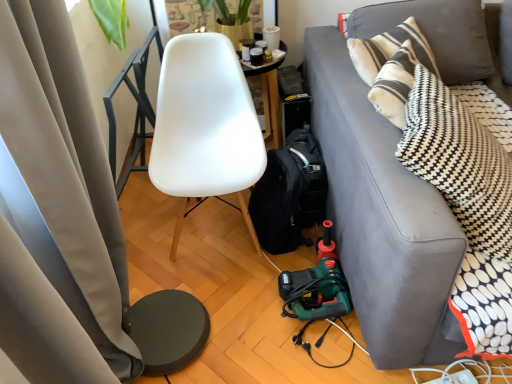
At what (x,y) coordinates should I click in order to perform the action: click on black fabric backpack at lower center. Please return your answer as a coordinate pair (x, y). Image resolution: width=512 pixels, height=384 pixels. Looking at the image, I should click on (289, 194).

The height and width of the screenshot is (384, 512). Describe the element at coordinates (205, 126) in the screenshot. I see `white matte chair at center` at that location.

This screenshot has width=512, height=384. I want to click on black fabric backpack at lower center, so click(x=289, y=194).

How different are the orientations of gray fabric couch at right and black fabric backpack at lower center in degrees?

1.77 degrees separate the facing orientations of gray fabric couch at right and black fabric backpack at lower center.

From a real-world perspective, is gray fabric couch at right above or below black fabric backpack at lower center?

Clearly, from a real-world perspective, gray fabric couch at right is above black fabric backpack at lower center.

Identify the location of backpack on the left of gray fabric couch at right. The width and height of the screenshot is (512, 384). (289, 194).

Based on the photo, between gray fabric couch at right and black fabric backpack at lower center, which one has smaller width?

Thinner between the two is black fabric backpack at lower center.

I want to click on studio couch that appears above the white plastic power outlet at lower right (from the image's perspective), so click(382, 218).

Considering the sizes of objects gray fabric couch at right and white plastic power outlet at lower right in the image provided, who is thinner, gray fabric couch at right or white plastic power outlet at lower right?

white plastic power outlet at lower right.

Is gray fabric couch at right turned away from white plastic power outlet at lower right?

gray fabric couch at right is not turned away from white plastic power outlet at lower right.

Is there a large distance between matte gray curtain at left and white matte chair at center?

They are positioned close to each other.

Is matte gray curtain at left bigger or smaller than white matte chair at center?

In the image, matte gray curtain at left appears to be larger than white matte chair at center.

Is matte gray curtain at left facing away from white matte chair at center?

matte gray curtain at left does not have its back to white matte chair at center.

Is gray fabric couch at right closer to the viewer compared to white matte chair at center?

That is True.

From the image's perspective, is gray fabric couch at right beneath white matte chair at center?

No.

Is gray fabric couch at right positioned with its back to white matte chair at center?

No.

Who is taller, gray fabric couch at right or white matte chair at center?

Standing taller between the two is white matte chair at center.

Does matte gray curtain at left appear on the left side of white plastic power outlet at lower right?

Yes, matte gray curtain at left is to the left of white plastic power outlet at lower right.

Which of these two, matte gray curtain at left or white plastic power outlet at lower right, is bigger?

Bigger between the two is matte gray curtain at left.

Are matte gray curtain at left and white plastic power outlet at lower right located far from each other?

Yes, matte gray curtain at left and white plastic power outlet at lower right are quite far apart.

Considering the relative sizes of black fabric backpack at lower center and white matte chair at center in the image provided, is black fabric backpack at lower center bigger than white matte chair at center?

Incorrect, black fabric backpack at lower center is not larger than white matte chair at center.

Consider the image. From their relative heights in the image, would you say black fabric backpack at lower center is taller or shorter than white matte chair at center?

black fabric backpack at lower center is shorter than white matte chair at center.

Considering the sizes of black fabric backpack at lower center and white matte chair at center in the image, is black fabric backpack at lower center wider or thinner than white matte chair at center?

In the image, black fabric backpack at lower center appears to be wider than white matte chair at center.

From the image's perspective, between white plastic power outlet at lower right and black fabric backpack at lower center, who is located below?

white plastic power outlet at lower right, from the image's perspective.

Does white plastic power outlet at lower right come in front of black fabric backpack at lower center?

Yes.

Would you say white plastic power outlet at lower right is a long distance from black fabric backpack at lower center?

They are positioned close to each other.

Considering the sizes of objects white plastic power outlet at lower right and black fabric backpack at lower center in the image provided, who is taller, white plastic power outlet at lower right or black fabric backpack at lower center?

With more height is black fabric backpack at lower center.

Identify the location of backpack behind the gray fabric couch at right. The width and height of the screenshot is (512, 384). (289, 194).

In order to click on power outlet on the left of gray fabric couch at right in this screenshot , I will do `click(455, 378)`.

Which object lies further to the anchor point black fabric backpack at lower center, matte gray curtain at left or white plastic power outlet at lower right?

white plastic power outlet at lower right is positioned further to the anchor black fabric backpack at lower center.

Which object lies further to the anchor point matte gray curtain at left, white matte chair at center or white plastic power outlet at lower right?

Based on the image, white plastic power outlet at lower right appears to be further to matte gray curtain at left.

Looking at the image, which one is located further to black fabric backpack at lower center, matte gray curtain at left or white matte chair at center?

The object further to black fabric backpack at lower center is matte gray curtain at left.

Considering their positions, is white plastic power outlet at lower right positioned closer to gray fabric couch at right than black fabric backpack at lower center?

The object closer to gray fabric couch at right is black fabric backpack at lower center.

From the picture: Which object lies further to the anchor point white matte chair at center, matte gray curtain at left or white plastic power outlet at lower right?

white plastic power outlet at lower right.

Based on their spatial positions, is gray fabric couch at right or black fabric backpack at lower center closer to matte gray curtain at left?

black fabric backpack at lower center lies closer to matte gray curtain at left than the other object.

Considering their positions, is white plastic power outlet at lower right positioned further to black fabric backpack at lower center than matte gray curtain at left?

Based on the image, white plastic power outlet at lower right appears to be further to black fabric backpack at lower center.

From the image, which object appears to be farther from white matte chair at center, white plastic power outlet at lower right or matte gray curtain at left?

white plastic power outlet at lower right.

At what (x,y) coordinates should I click in order to perform the action: click on chair between matte gray curtain at left and gray fabric couch at right in the horizontal direction. Please return your answer as a coordinate pair (x, y). This screenshot has width=512, height=384. Looking at the image, I should click on (205, 126).

The width and height of the screenshot is (512, 384). Find the location of `power outlet between matte gray curtain at left and black fabric backpack at lower center along the z-axis`. power outlet between matte gray curtain at left and black fabric backpack at lower center along the z-axis is located at coordinates (455, 378).

I want to click on backpack between white matte chair at center and white plastic power outlet at lower right from top to bottom, so click(289, 194).

At what (x,y) coordinates should I click in order to perform the action: click on backpack located between white matte chair at center and gray fabric couch at right in the left-right direction. Please return your answer as a coordinate pair (x, y). Looking at the image, I should click on (289, 194).